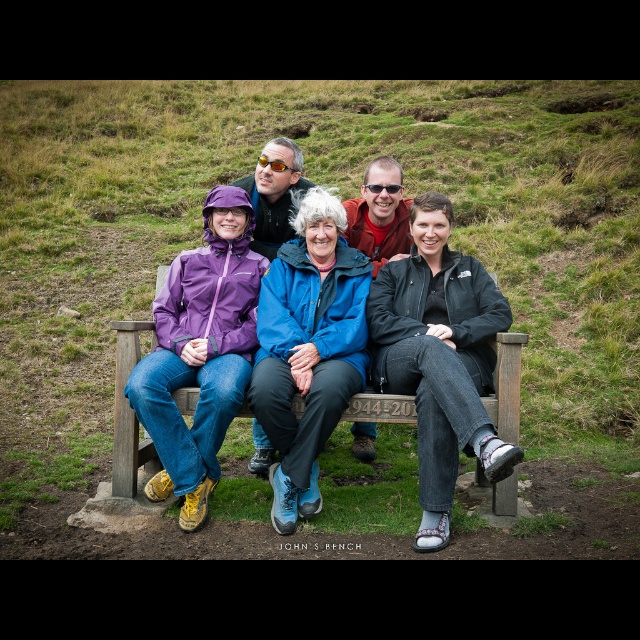
Question: Which point is closer to the camera taking this photo?

Choices:
 (A) 120,381
 (B) 152,483
 (C) 307,317
 (D) 243,316

Answer: (B)

Question: Considering the real-world distances, which object is farthest from the matte purple jacket at left?

Choices:
 (A) purple waterproof jacket at center
 (B) blue waterproof jacket at center
 (C) wooden bench at center

Answer: (C)

Question: Which of these objects is positioned farthest from the blue waterproof jacket at center?

Choices:
 (A) matte purple jacket at left
 (B) wooden bench at center
 (C) purple waterproof jacket at center

Answer: (B)

Question: Is blue waterproof jacket at center wider than wooden bench at center?

Choices:
 (A) no
 (B) yes

Answer: (B)

Question: Does matte purple jacket at left appear over wooden bench at center?

Choices:
 (A) yes
 (B) no

Answer: (A)

Question: Can you confirm if blue waterproof jacket at center is thinner than wooden bench at center?

Choices:
 (A) no
 (B) yes

Answer: (A)